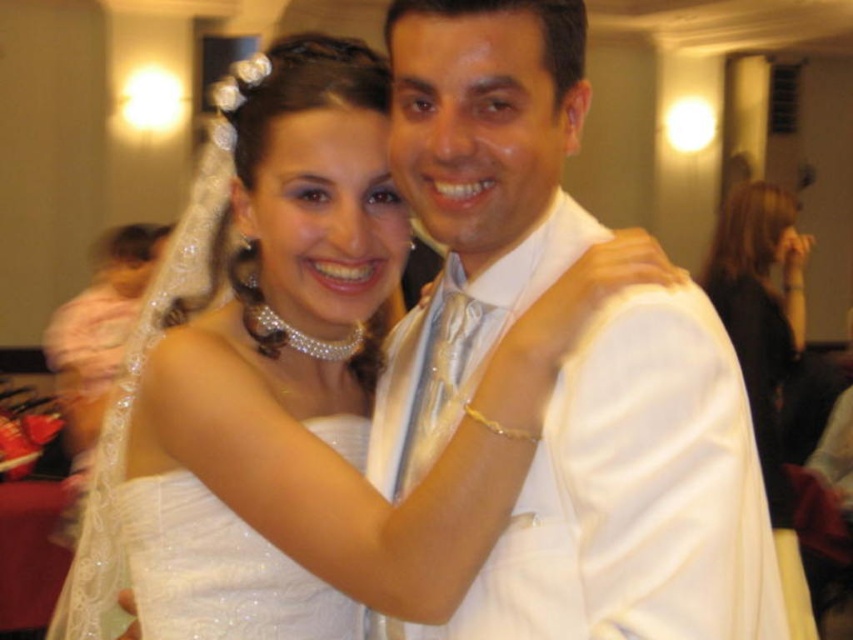
Question: Considering the real-world distances, which object is closest to the white satin shirt at center?

Choices:
 (A) white satin dress at center
 (B) satin black dress at center

Answer: (A)

Question: Based on their relative distances, which object is nearer to the white satin dress at center?

Choices:
 (A) satin black dress at center
 (B) white satin shirt at center
 (C) satin white dress at center

Answer: (C)

Question: Does white satin dress at center have a smaller size compared to satin white dress at center?

Choices:
 (A) no
 (B) yes

Answer: (A)

Question: Which of the following is the closest to the observer?

Choices:
 (A) (154, 548)
 (B) (738, 204)
 (C) (627, 596)
 (D) (656, 244)

Answer: (C)

Question: Does white satin dress at center have a smaller size compared to white satin shirt at center?

Choices:
 (A) no
 (B) yes

Answer: (A)

Question: In this image, where is white satin dress at center located relative to white satin shirt at center?

Choices:
 (A) below
 (B) above

Answer: (A)